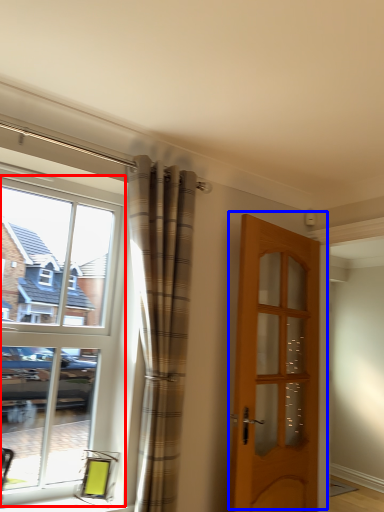
Question: Which object appears closest to the camera in this image, window (highlighted by a red box) or door (highlighted by a blue box)?

Choices:
 (A) window
 (B) door

Answer: (A)